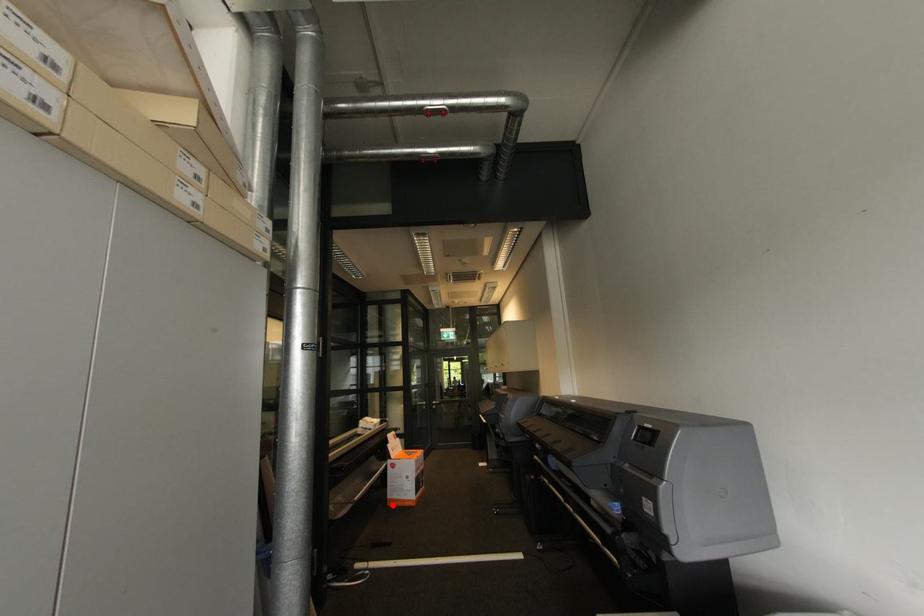
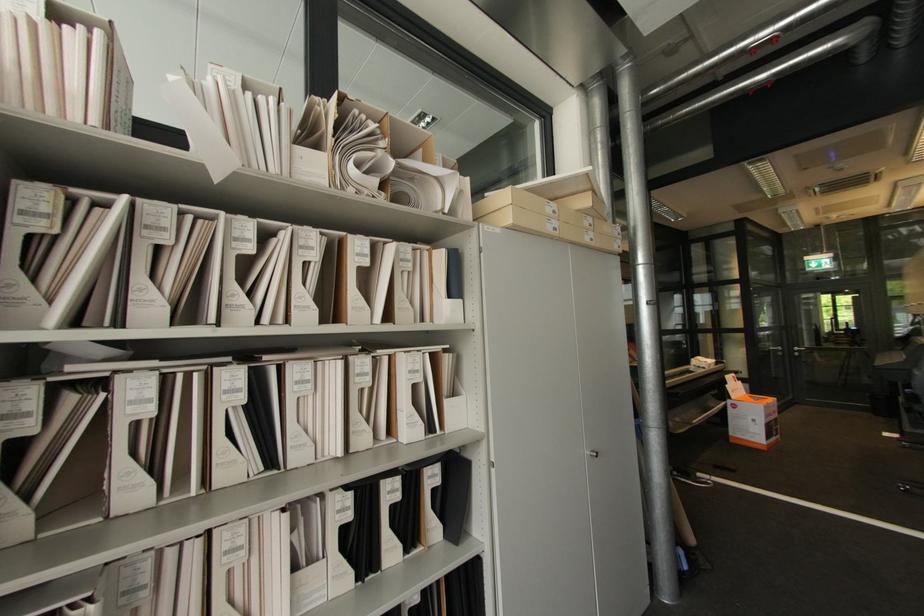
Where in the second image is the point corresponding to the highlighted location from the first image?

(736, 442)